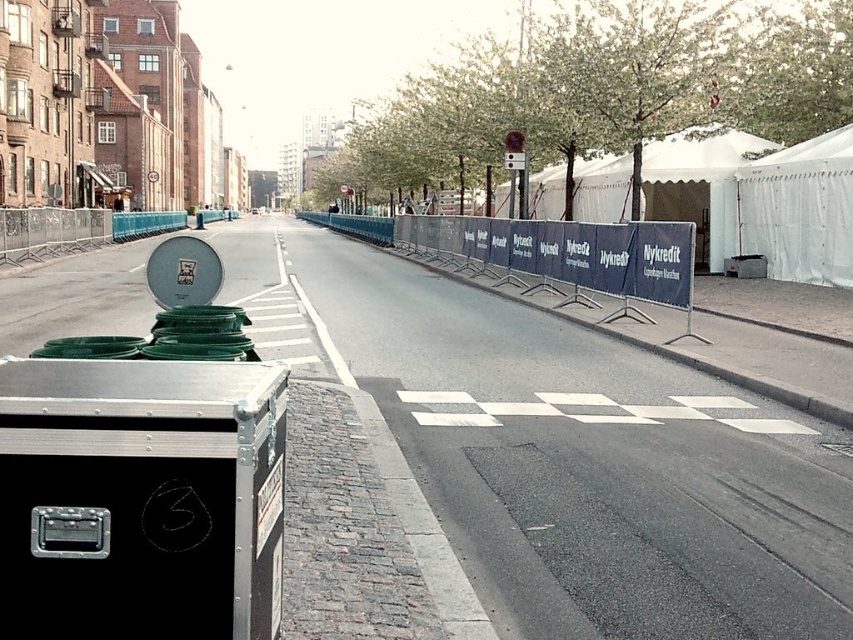
Question: Can you confirm if white fabric tent at center-right is thinner than white fabric tent at right?

Choices:
 (A) no
 (B) yes

Answer: (A)

Question: Which object is closer to the camera taking this photo?

Choices:
 (A) blue fabric barrier at center
 (B) white fabric tent at right
 (C) white fabric tent at center-right

Answer: (A)

Question: Which point is closer to the camera?

Choices:
 (A) white fabric tent at right
 (B) blue fabric barrier at center
 (C) white fabric tent at center-right

Answer: (B)

Question: Is blue fabric barrier at center below white fabric tent at right?

Choices:
 (A) yes
 (B) no

Answer: (B)

Question: Which of the following is the farthest from the observer?

Choices:
 (A) (567, 250)
 (B) (590, 198)

Answer: (B)

Question: Is white fabric tent at center-right closer to camera compared to white fabric tent at right?

Choices:
 (A) no
 (B) yes

Answer: (A)